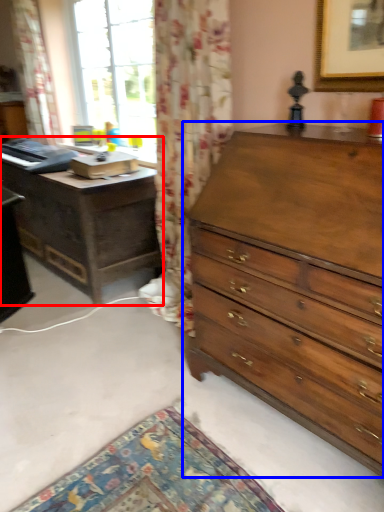
Question: Which object appears closest to the camera in this image, nightstand (highlighted by a red box) or chest of drawers (highlighted by a blue box)?

Choices:
 (A) nightstand
 (B) chest of drawers

Answer: (B)